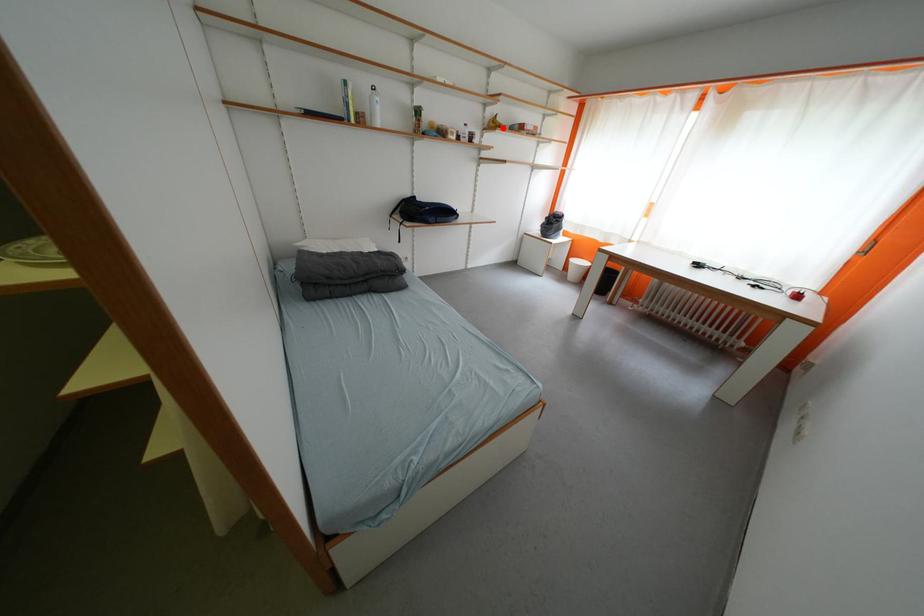
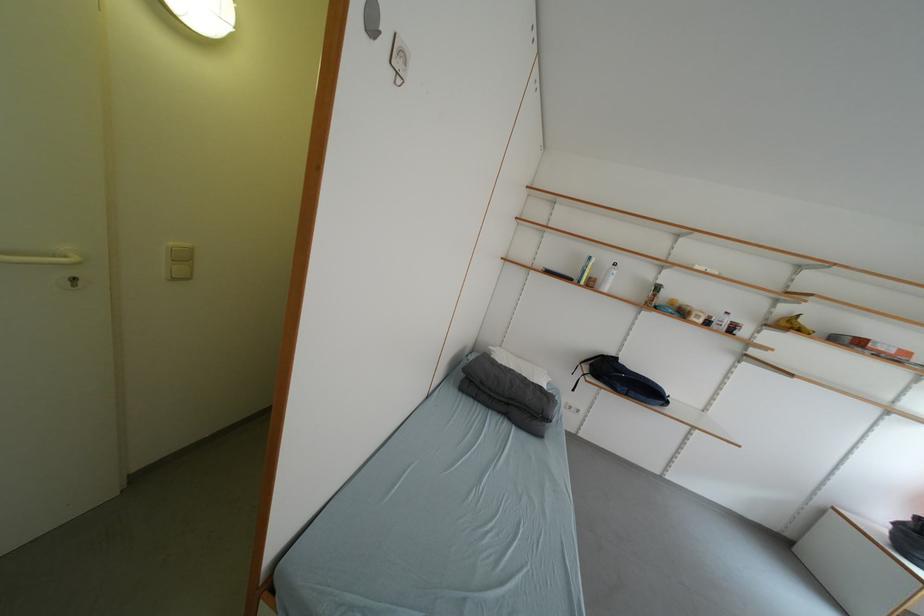
Question: A red point is marked in image1. In image2, is the corresponding 3D point closer to the camera or farther? Reply with the corresponding letter.

Choices:
 (A) The corresponding 3D point is closer.
 (B) The corresponding 3D point is farther.

Answer: (B)